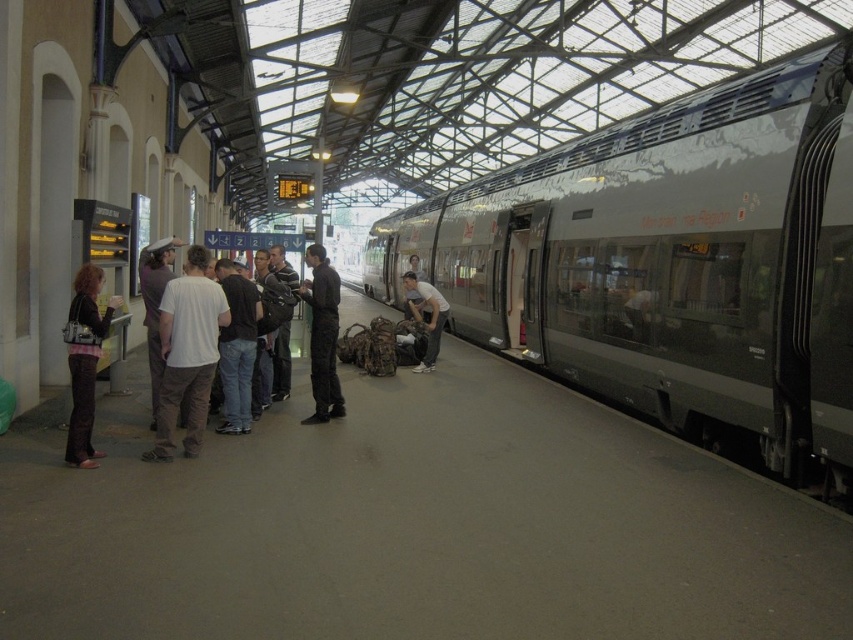
Can you confirm if dark gray jeans at center is shorter than matte white shirt at center?

No, dark gray jeans at center is not shorter than matte white shirt at center.

I want to click on dark gray jeans at center, so click(236, 346).

Does point (79, 330) come in front of point (230, 308)?

Yes, it is in front of point (230, 308).

Which is behind, point (93, 310) or point (229, 342)?

The point (229, 342) is more distant.

Measure the distance between point (79,282) and camera.

The distance of point (79,282) from camera is 6.02 meters.

Find the location of `matte black jacket at left`. matte black jacket at left is located at coordinates (84, 360).

This screenshot has height=640, width=853. I want to click on silver metallic train at center, so click(x=672, y=262).

Is point (598, 305) closer to viewer compared to point (332, 301)?

No, (598, 305) is behind (332, 301).

The image size is (853, 640). I want to click on silver metallic train at center, so click(672, 262).